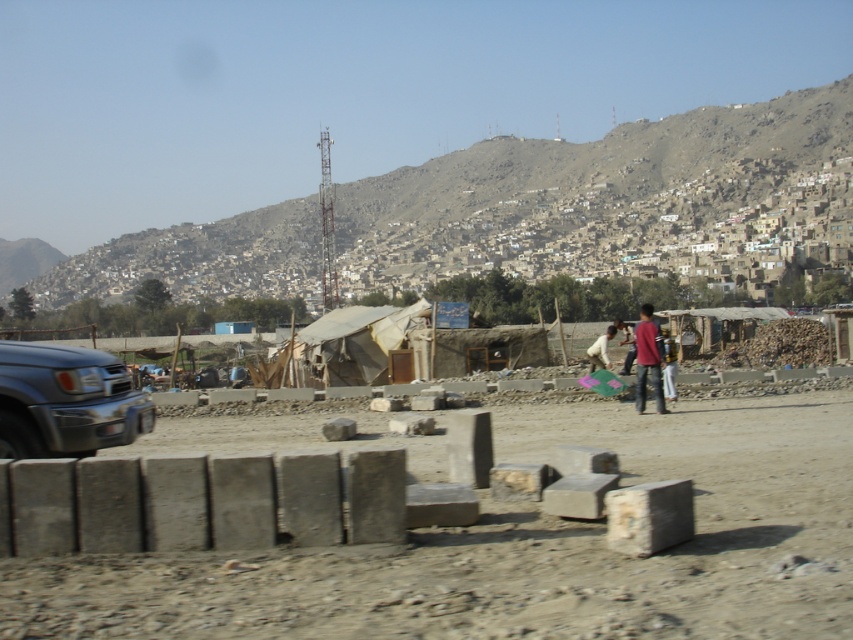
Question: Which object appears closest to the camera in this image?

Choices:
 (A) white cotton shirt at center
 (B) red shirt at center
 (C) brown textured hillside at upper center

Answer: (B)

Question: Can you confirm if gray concrete blocks at center is positioned below red shirt at center?

Choices:
 (A) no
 (B) yes

Answer: (B)

Question: Which point is closer to the camera?

Choices:
 (A) brown textured hillside at upper center
 (B) light brown fabric pants at center-right

Answer: (B)

Question: Which of the following is the farthest from the observer?

Choices:
 (A) gray concrete blocks at center
 (B) metallic gray suv at left
 (C) brown textured hillside at upper center

Answer: (C)

Question: Can you confirm if gray concrete blocks at center is positioned above white cotton shirt at center?

Choices:
 (A) yes
 (B) no

Answer: (B)

Question: Considering the relative positions of brown textured hillside at upper center and red shirt at center in the image provided, where is brown textured hillside at upper center located with respect to red shirt at center?

Choices:
 (A) above
 (B) below

Answer: (A)